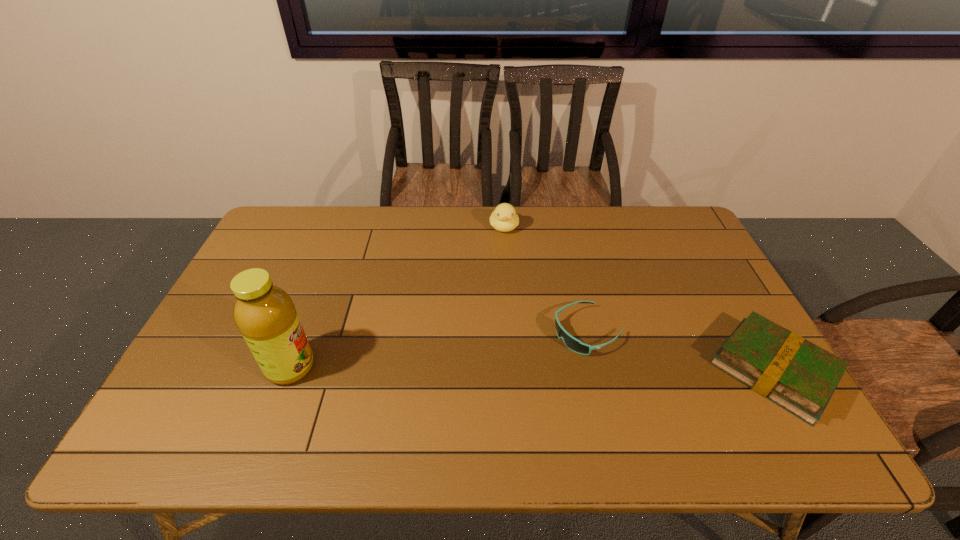
Locate an element on the screen. free space located 0.130m at the beak of the duckling is located at coordinates (507, 263).

This screenshot has height=540, width=960. In order to click on vacant space positioned at the beak of the duckling in this screenshot , I will do `click(507, 265)`.

Locate an element on the screen. The width and height of the screenshot is (960, 540). vacant area located at the beak of the duckling is located at coordinates (510, 304).

At what (x,y) coordinates should I click in order to perform the action: click on free space located on the front-facing side of the sunglasses. Please return your answer as a coordinate pair (x, y). The image size is (960, 540). Looking at the image, I should click on (504, 375).

Identify the location of free space located on the front-facing side of the sunglasses. The height and width of the screenshot is (540, 960). (520, 367).

Where is `blank space located on the front-facing side of the sunglasses`? blank space located on the front-facing side of the sunglasses is located at coordinates (451, 404).

Where is `object situated at the far edge`? object situated at the far edge is located at coordinates (504, 218).

Find the location of a particular element. The height and width of the screenshot is (540, 960). fruit juice that is at the near edge is located at coordinates (265, 315).

Identify the location of book positioned at the near edge. (799, 376).

At what (x,y) coordinates should I click in order to perform the action: click on object present at the right edge. Please return your answer as a coordinate pair (x, y). The image size is (960, 540). Looking at the image, I should click on (799, 376).